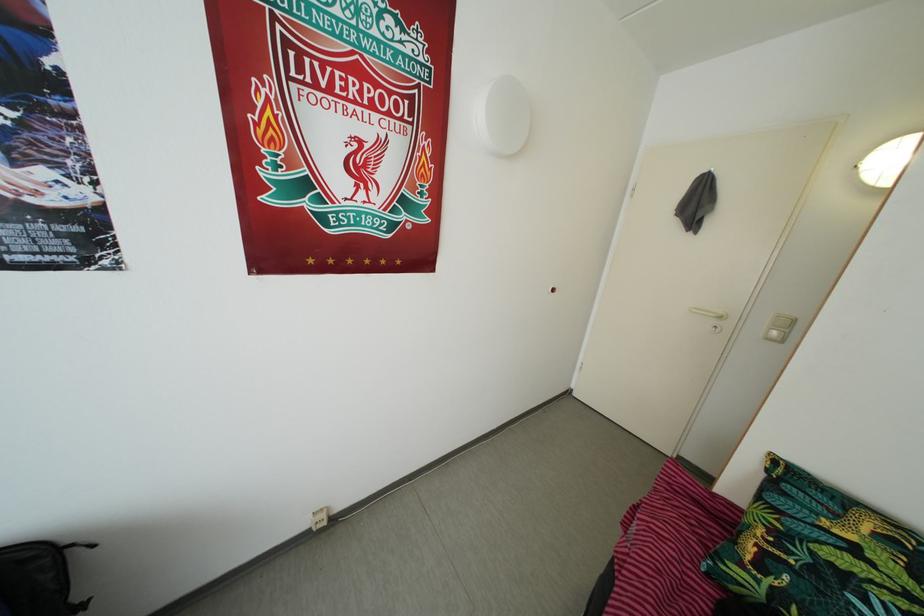
At what (x,y) coordinates should I click in order to perform the action: click on white light switch. Please return your answer as a coordinate pair (x, y). This screenshot has width=924, height=616. Looking at the image, I should click on (320, 517).